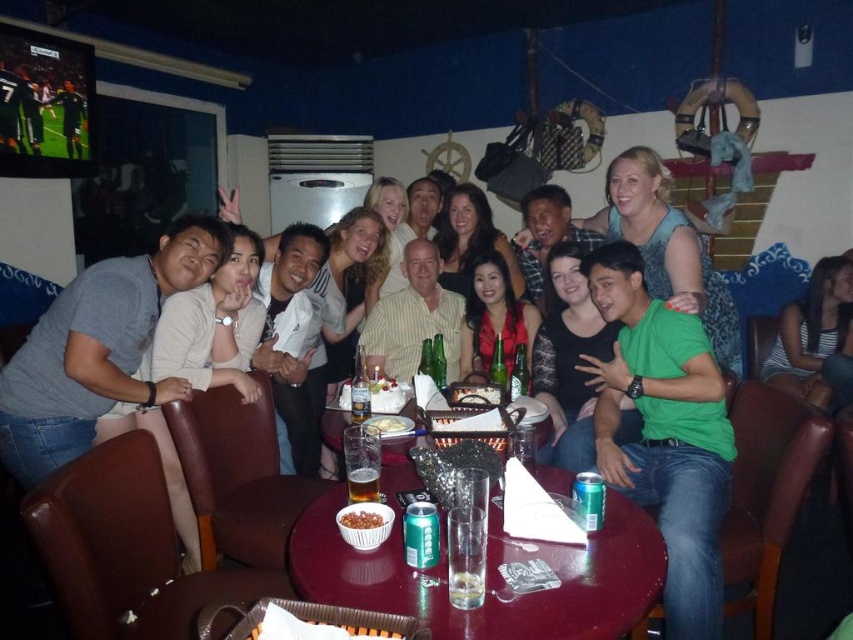
Question: Based on their relative distances, which object is farther from the shiny metallic table at center?

Choices:
 (A) striped fabric shirt at right
 (B) clear glass at table center
 (C) translucent glass beer at table center
 (D) smooth wooden table at center

Answer: (A)

Question: Can you confirm if striped fabric shirt at right is wider than translucent glass beer at table center?

Choices:
 (A) no
 (B) yes

Answer: (B)

Question: Which object appears farthest from the camera in this image?

Choices:
 (A) smooth wooden table at center
 (B) translucent glass beer at table center
 (C) striped fabric shirt at right
 (D) shiny metallic table at center

Answer: (C)

Question: Is the position of matte black dress at center more distant than that of translucent glass beer at table center?

Choices:
 (A) no
 (B) yes

Answer: (B)

Question: Considering the relative positions of striped fabric shirt at right and matte black dress at center in the image provided, where is striped fabric shirt at right located with respect to matte black dress at center?

Choices:
 (A) right
 (B) left

Answer: (A)

Question: Which of the following is the closest to the observer?

Choices:
 (A) translucent glass beer at table center
 (B) clear glass at table center
 (C) smooth wooden table at center
 (D) striped fabric shirt at right

Answer: (C)